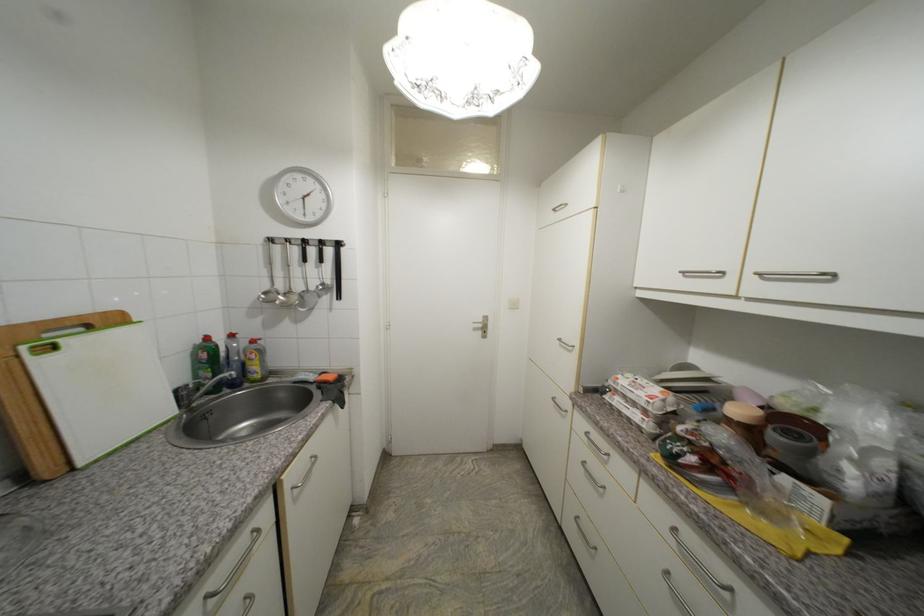
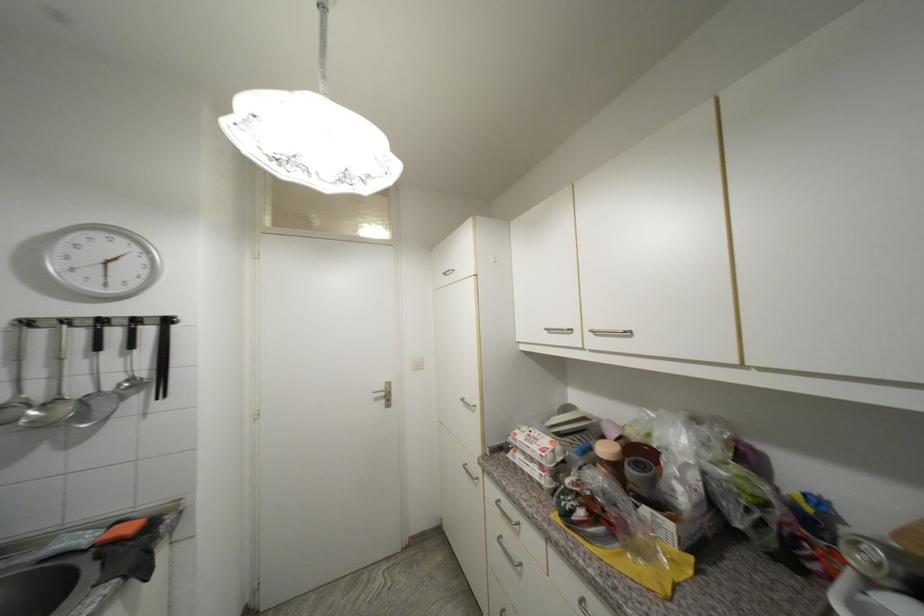
Locate, in the second image, the point that corresponds to [426,102] in the first image.

(286, 175)